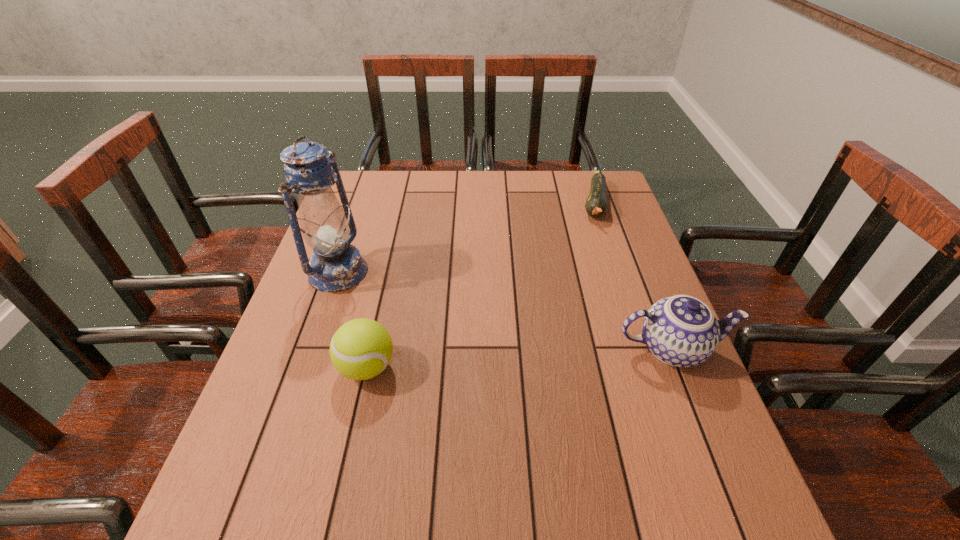
Identify the location of free spot on the desktop that is between the third tallest object and the third shortest object and is positioned at the blossom end of the shortest object. This screenshot has height=540, width=960. (564, 355).

Identify the location of free spot on the desktop that is between the tennis ball and the second tallest object and is positioned on the front-facing side of the third nearest object. Image resolution: width=960 pixels, height=540 pixels. (557, 355).